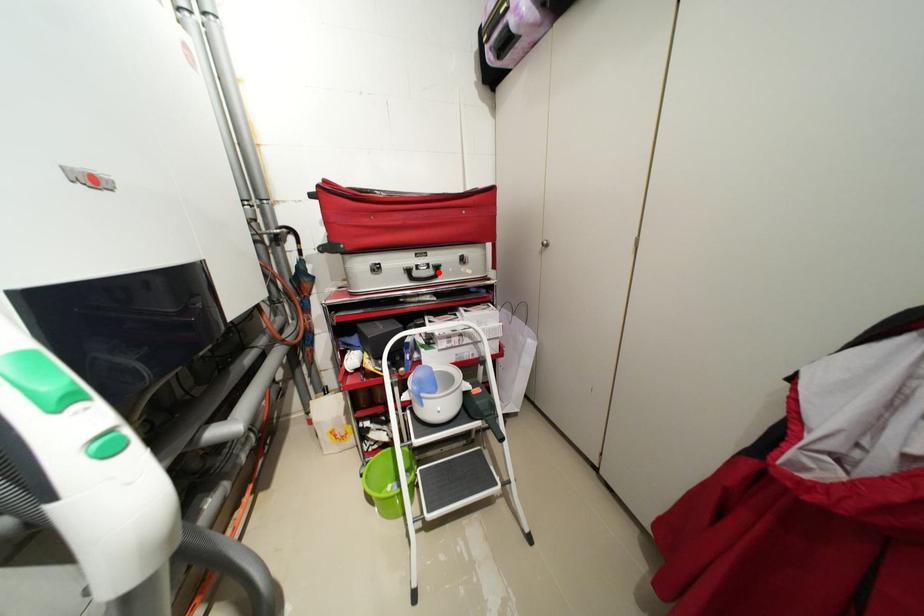
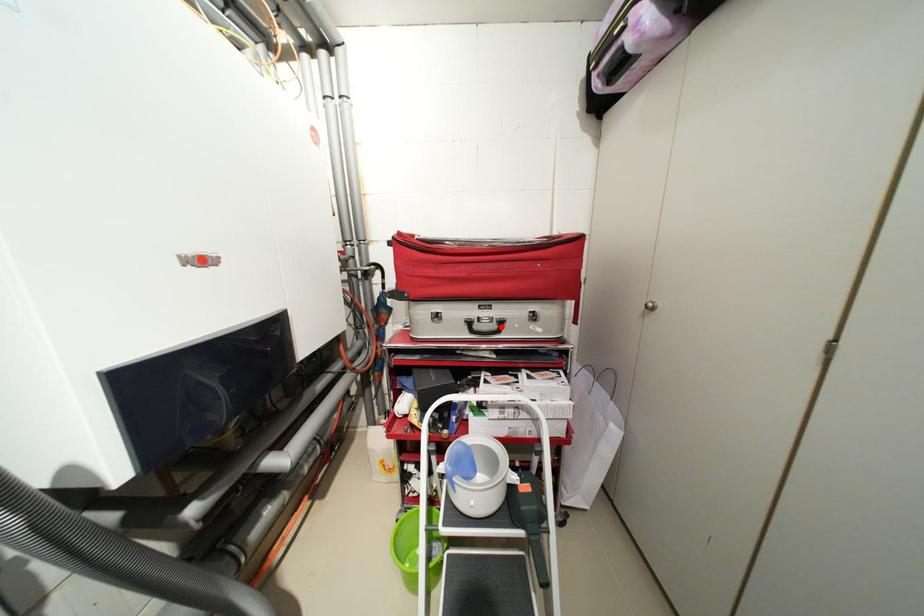
I am providing you with two images of the same scene from different viewpoints. A red point is marked on the first image and another point is marked on the second image. Do the highlighted points in image1 and image2 indicate the same real-world spot?

Yes